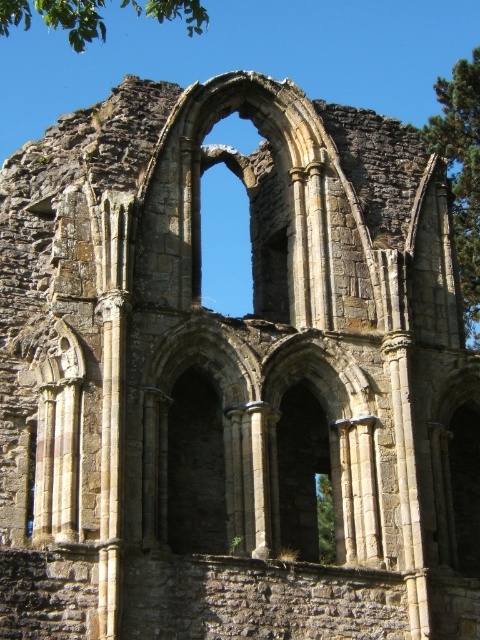
Question: Which point is closer to the camera?

Choices:
 (A) 46,10
 (B) 456,177

Answer: (A)

Question: Does green leafy tree at upper right appear on the right side of green leafy tree at upper left?

Choices:
 (A) yes
 (B) no

Answer: (A)

Question: Which of the following is the farthest from the observer?

Choices:
 (A) (57, 19)
 (B) (430, 134)

Answer: (B)

Question: Does green leafy tree at upper right appear over green leafy tree at upper left?

Choices:
 (A) no
 (B) yes

Answer: (A)

Question: Which of the following is the farthest from the observer?

Choices:
 (A) (40, 4)
 (B) (462, 147)

Answer: (B)

Question: Is green leafy tree at upper right closer to the viewer compared to green leafy tree at upper left?

Choices:
 (A) no
 (B) yes

Answer: (A)